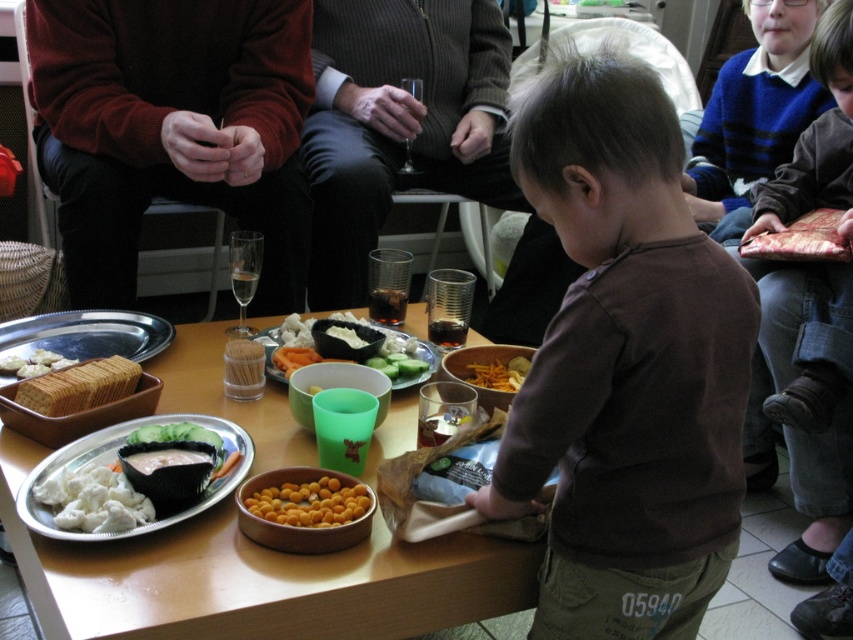
You are a guest at the gathering and want to take a bite of the white creamy cheese at lower left and the white cracker at center. Which one do you need to reach further to get?

The white creamy cheese at lower left is located at the lower left of the table, so you need to reach further to get it compared to the white cracker at center which is closer to you.

Consider the image. You are a guest at the gathering and want to reach for the white cracker at center. Which direction should you move your hand relative to the white matte platter at center to get it?

The white cracker at center is to the left of the white matte platter at center, so you should move your hand to the left relative to the platter to reach the cracker.